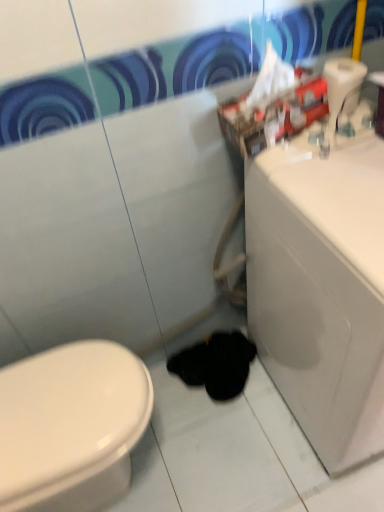
Question: Does white plastic toilet paper at upper right lie behind white glossy sink at right?

Choices:
 (A) yes
 (B) no

Answer: (A)

Question: From the image's perspective, is white plastic toilet paper at upper right on top of white glossy sink at right?

Choices:
 (A) yes
 (B) no

Answer: (A)

Question: Does white plastic toilet paper at upper right have a greater height compared to white glossy sink at right?

Choices:
 (A) no
 (B) yes

Answer: (A)

Question: Is white plastic toilet paper at upper right not inside white glossy sink at right?

Choices:
 (A) yes
 (B) no

Answer: (A)

Question: Could white glossy sink at right be considered to be inside white plastic toilet paper at upper right?

Choices:
 (A) no
 (B) yes

Answer: (A)

Question: Does white plastic toilet paper at upper right appear on the left side of white glossy sink at right?

Choices:
 (A) yes
 (B) no

Answer: (A)

Question: From the image's perspective, is black fuzzy animal at lower center on top of white plastic toilet paper at upper right?

Choices:
 (A) yes
 (B) no

Answer: (B)

Question: Does black fuzzy animal at lower center appear on the right side of white plastic toilet paper at upper right?

Choices:
 (A) yes
 (B) no

Answer: (B)

Question: Considering the relative positions of black fuzzy animal at lower center and white plastic toilet paper at upper right in the image provided, is black fuzzy animal at lower center to the left of white plastic toilet paper at upper right from the viewer's perspective?

Choices:
 (A) no
 (B) yes

Answer: (B)

Question: Is black fuzzy animal at lower center looking in the opposite direction of white plastic toilet paper at upper right?

Choices:
 (A) no
 (B) yes

Answer: (A)

Question: Can you confirm if black fuzzy animal at lower center is shorter than white plastic toilet paper at upper right?

Choices:
 (A) no
 (B) yes

Answer: (B)

Question: From the image's perspective, does black fuzzy animal at lower center appear lower than white plastic toilet paper at upper right?

Choices:
 (A) yes
 (B) no

Answer: (A)

Question: Is white glossy sink at right outside of black fuzzy animal at lower center?

Choices:
 (A) no
 (B) yes

Answer: (B)